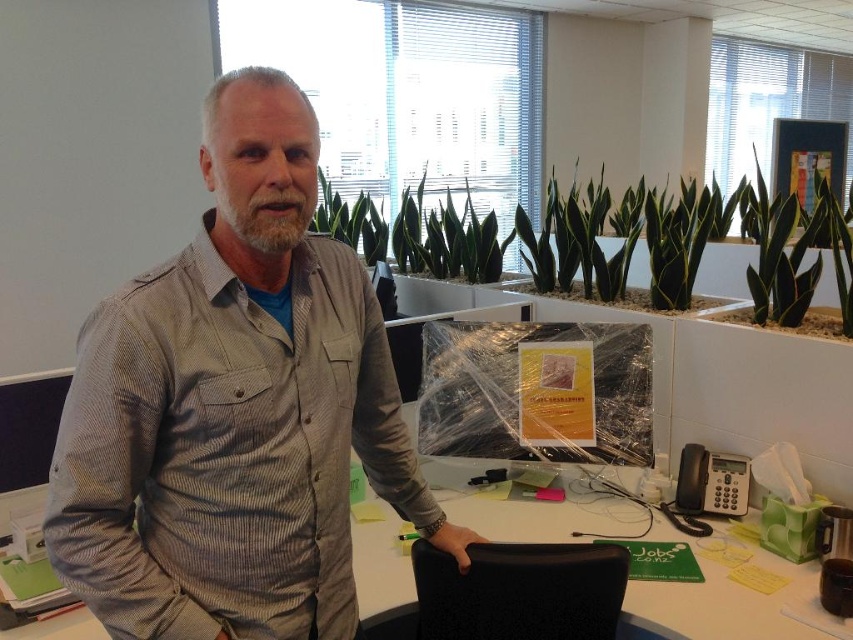
You are an office worker who needs to move a box from the white plastic table at center to the black textured swivel chair at center. Can you place the box directly on top of the chair?

The white plastic table at center is located above the black textured swivel chair at center, so yes, you can place the box directly on top of the black textured swivel chair at center since the table is above it.

You are a delivery person who needs to place a large box on the desk. The box is 14 inches wide. Can you fit it between the white plastic table at center and the black textured swivel chair at center?

The distance between the white plastic table at center and the black textured swivel chair at center is 12.05 inches. Since the box is 14 inches wide, it cannot fit in the space between them.

What is the 2D coordinate of the gray striped shirt at center?

The gray striped shirt at center is located at the 2D coordinate point of (234,408).